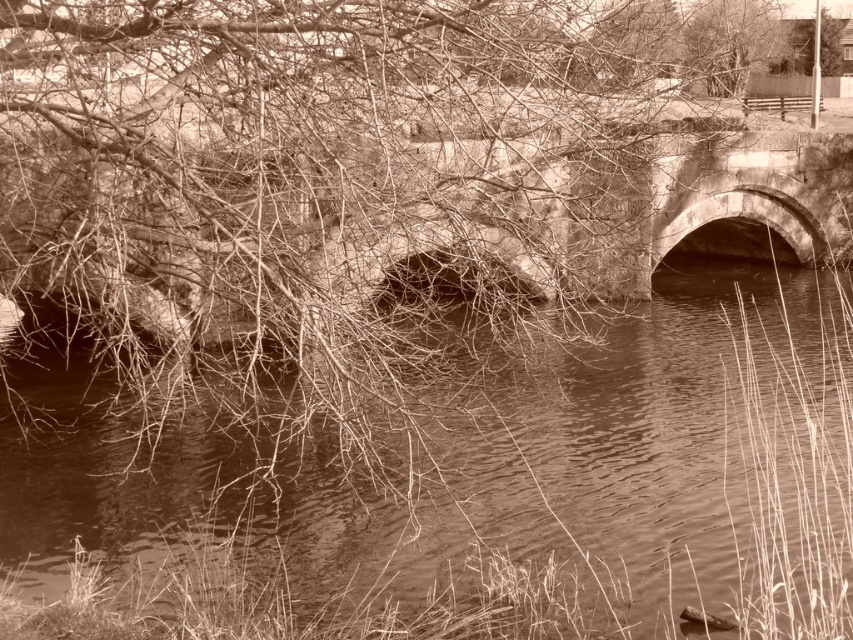
Is brown water at center wider than stone bridge at center?

Yes, brown water at center is wider than stone bridge at center.

Is the position of brown water at center more distant than that of stone bridge at center?

No, it is in front of stone bridge at center.

I want to click on brown water at center, so click(x=500, y=500).

Is brown water at center further to the viewer compared to bare branches at upper center?

That is False.

Does brown water at center have a greater width compared to bare branches at upper center?

Yes, brown water at center is wider than bare branches at upper center.

Find the location of `brown water at center`. brown water at center is located at coordinates (500, 500).

Identify the location of brown water at center. The image size is (853, 640). (500, 500).

Is stone bridge at center smaller than bare branches at upper center?

Actually, stone bridge at center might be larger than bare branches at upper center.

Is the position of stone bridge at center more distant than that of bare branches at upper center?

That is False.

Is point (515, 253) in front of point (723, 76)?

That is True.

Locate an element on the screen. The height and width of the screenshot is (640, 853). stone bridge at center is located at coordinates (595, 209).